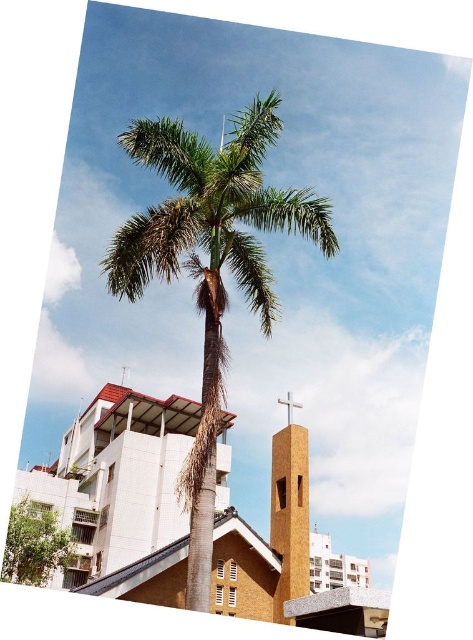
Question: Where is green leafy tree at lower left located in relation to metallic cross at center in the image?

Choices:
 (A) right
 (B) left

Answer: (B)

Question: Among these points, which one is nearest to the camera?

Choices:
 (A) (292, 406)
 (B) (276, 468)
 (C) (352, 584)
 (D) (10, 540)

Answer: (B)

Question: From the image, what is the correct spatial relationship of yellow textured bell tower at center in relation to metallic cross at center?

Choices:
 (A) right
 (B) left

Answer: (B)

Question: Estimate the real-world distances between objects in this image. Which object is closer to the green leafy tree at lower left?

Choices:
 (A) yellow textured bell tower at center
 (B) green leafy palm tree at center

Answer: (A)

Question: Among these objects, which one is nearest to the camera?

Choices:
 (A) metallic cross at center
 (B) green leafy tree at lower left
 (C) brown textured church steeple at center

Answer: (C)

Question: Can you confirm if brown textured church steeple at center is thinner than green leafy palm tree at center?

Choices:
 (A) yes
 (B) no

Answer: (B)